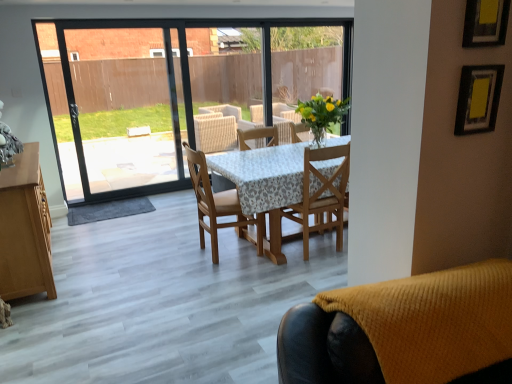
Question: Can you confirm if wooden chair at center, which ranks as the first chair in back-to-front order, is bigger than wooden chair at center, which is the 2th chair in front-to-back order?

Choices:
 (A) no
 (B) yes

Answer: (B)

Question: From the image's perspective, is wooden chair at center, the third chair positioned from the front, on wooden chair at center, which ranks as the second chair in back-to-front order?

Choices:
 (A) no
 (B) yes

Answer: (A)

Question: Is wooden chair at center, which ranks as the first chair in back-to-front order, outside wooden chair at center, which is the 2th chair in front-to-back order?

Choices:
 (A) yes
 (B) no

Answer: (A)

Question: Can you confirm if wooden chair at center, which ranks as the first chair in back-to-front order, is wider than wooden chair at center, which is the 2th chair in front-to-back order?

Choices:
 (A) yes
 (B) no

Answer: (A)

Question: Does wooden chair at center, which ranks as the first chair in back-to-front order, appear on the right side of wooden chair at center, which ranks as the second chair in back-to-front order?

Choices:
 (A) no
 (B) yes

Answer: (A)

Question: Can you confirm if wooden chair at center, which ranks as the first chair in back-to-front order, is smaller than wooden chair at center, which is the 2th chair in front-to-back order?

Choices:
 (A) no
 (B) yes

Answer: (A)

Question: Is there a large distance between wooden chair at center, which ranks as the second chair in back-to-front order, and knitted yellow chair at lower right, the 3th chair from the back?

Choices:
 (A) no
 (B) yes

Answer: (B)

Question: Considering the relative sizes of wooden chair at center, which ranks as the second chair in back-to-front order, and knitted yellow chair at lower right, which is the first chair from front to back, in the image provided, is wooden chair at center, which ranks as the second chair in back-to-front order, taller than knitted yellow chair at lower right, which is the first chair from front to back,?

Choices:
 (A) yes
 (B) no

Answer: (A)

Question: Are wooden chair at center, which is the 2th chair in front-to-back order, and knitted yellow chair at lower right, which is the first chair from front to back, beside each other?

Choices:
 (A) yes
 (B) no

Answer: (B)

Question: Can you confirm if wooden chair at center, which ranks as the second chair in back-to-front order, is smaller than knitted yellow chair at lower right, the 3th chair from the back?

Choices:
 (A) yes
 (B) no

Answer: (B)

Question: Could you tell me if wooden chair at center, which ranks as the second chair in back-to-front order, is turned towards knitted yellow chair at lower right, which is the first chair from front to back?

Choices:
 (A) no
 (B) yes

Answer: (A)

Question: Is wooden chair at center, which is the 2th chair in front-to-back order, looking in the opposite direction of knitted yellow chair at lower right, the 3th chair from the back?

Choices:
 (A) yes
 (B) no

Answer: (B)

Question: Is knitted yellow chair at lower right, which is the first chair from front to back, facing away from wooden chair at center, which ranks as the first chair in back-to-front order?

Choices:
 (A) yes
 (B) no

Answer: (A)